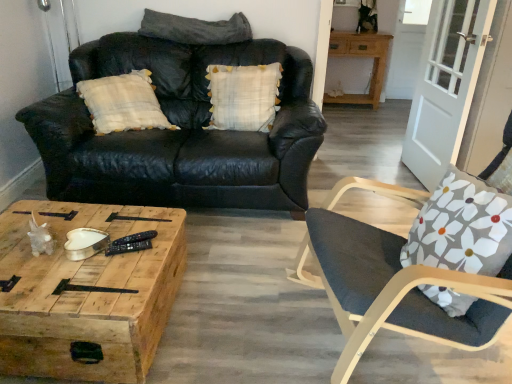
Question: Is white wood screen door at right facing towards floral fabric cushion at right?

Choices:
 (A) yes
 (B) no

Answer: (B)

Question: From the image's perspective, is white wood screen door at right below floral fabric cushion at right?

Choices:
 (A) yes
 (B) no

Answer: (B)

Question: Is white wood screen door at right not close to floral fabric cushion at right?

Choices:
 (A) yes
 (B) no

Answer: (A)

Question: Considering the relative sizes of white wood screen door at right and floral fabric cushion at right in the image provided, is white wood screen door at right thinner than floral fabric cushion at right?

Choices:
 (A) yes
 (B) no

Answer: (A)

Question: Is the position of white wood screen door at right less distant than that of floral fabric cushion at right?

Choices:
 (A) yes
 (B) no

Answer: (B)

Question: Is wooden table at upper right inside or outside of white plaid pillow at center, marked as the first pillow in a bottom-to-top arrangement?

Choices:
 (A) outside
 (B) inside

Answer: (A)

Question: Considering the positions of point (376, 44) and point (254, 104), is point (376, 44) closer or farther from the camera than point (254, 104)?

Choices:
 (A) farther
 (B) closer

Answer: (A)

Question: In terms of height, does wooden table at upper right look taller or shorter compared to white plaid pillow at center, marked as the first pillow in a bottom-to-top arrangement?

Choices:
 (A) short
 (B) tall

Answer: (B)

Question: Based on their positions, is wooden table at upper right located to the left or right of white plaid pillow at center, marked as the first pillow in a bottom-to-top arrangement?

Choices:
 (A) right
 (B) left

Answer: (A)

Question: Visually, is black leather couch at upper left positioned to the left or to the right of floral fabric cushion at right?

Choices:
 (A) left
 (B) right

Answer: (A)

Question: In terms of size, does black leather couch at upper left appear bigger or smaller than floral fabric cushion at right?

Choices:
 (A) small
 (B) big

Answer: (B)

Question: Considering their positions, is black leather couch at upper left located in front of or behind floral fabric cushion at right?

Choices:
 (A) front
 (B) behind

Answer: (B)

Question: Is black leather couch at upper left situated inside floral fabric cushion at right or outside?

Choices:
 (A) outside
 (B) inside

Answer: (A)

Question: Would you say wooden table at upper right is inside or outside black leather couch at upper left?

Choices:
 (A) inside
 (B) outside

Answer: (B)

Question: Considering the positions of wooden table at upper right and black leather couch at upper left in the image, is wooden table at upper right bigger or smaller than black leather couch at upper left?

Choices:
 (A) big
 (B) small

Answer: (B)